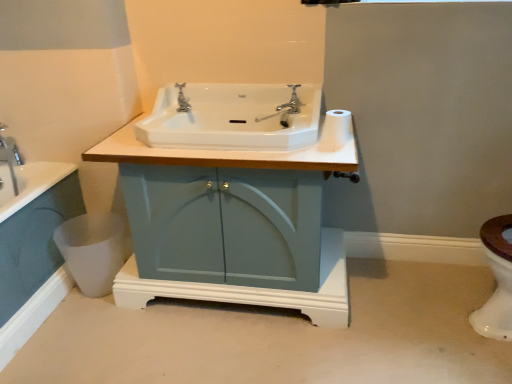
Question: From a real-world perspective, does white matte toilet paper at upper right sit lower than chrome metallic faucet at upper center?

Choices:
 (A) yes
 (B) no

Answer: (A)

Question: Can you confirm if white matte toilet paper at upper right is wider than chrome metallic faucet at upper center?

Choices:
 (A) yes
 (B) no

Answer: (B)

Question: Considering the relative positions of white matte toilet paper at upper right and chrome metallic faucet at upper center in the image provided, is white matte toilet paper at upper right to the right of chrome metallic faucet at upper center from the viewer's perspective?

Choices:
 (A) no
 (B) yes

Answer: (B)

Question: Does white matte toilet paper at upper right have a lesser height compared to chrome metallic faucet at upper center?

Choices:
 (A) no
 (B) yes

Answer: (B)

Question: Does white matte toilet paper at upper right have a smaller size compared to chrome metallic faucet at upper center?

Choices:
 (A) yes
 (B) no

Answer: (A)

Question: Does white matte toilet paper at upper right turn towards chrome metallic faucet at upper center?

Choices:
 (A) yes
 (B) no

Answer: (B)

Question: Is matte blue cabinet at center far away from white glossy toilet bowl at lower right?

Choices:
 (A) yes
 (B) no

Answer: (B)

Question: Does matte blue cabinet at center have a smaller size compared to white glossy toilet bowl at lower right?

Choices:
 (A) yes
 (B) no

Answer: (B)

Question: Considering the relative sizes of matte blue cabinet at center and white glossy toilet bowl at lower right in the image provided, is matte blue cabinet at center wider than white glossy toilet bowl at lower right?

Choices:
 (A) yes
 (B) no

Answer: (A)

Question: Considering the relative positions of matte blue cabinet at center and white glossy toilet bowl at lower right in the image provided, is matte blue cabinet at center to the right of white glossy toilet bowl at lower right from the viewer's perspective?

Choices:
 (A) yes
 (B) no

Answer: (A)

Question: Is matte blue cabinet at center outside white glossy toilet bowl at lower right?

Choices:
 (A) no
 (B) yes

Answer: (B)

Question: From the image's perspective, would you say matte blue cabinet at center is shown under white glossy toilet bowl at lower right?

Choices:
 (A) no
 (B) yes

Answer: (A)

Question: From the image's perspective, would you say chrome metallic faucet at upper center is positioned over white glossy sink at center?

Choices:
 (A) yes
 (B) no

Answer: (A)